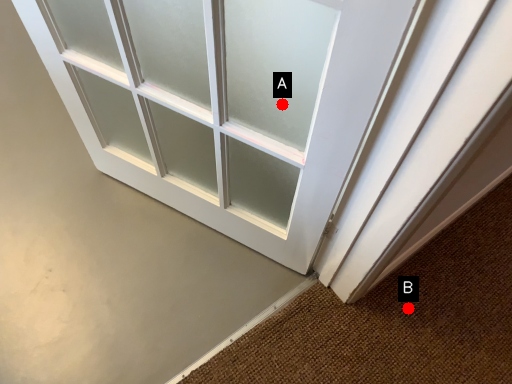
Question: Two points are circled on the image, labeled by A and B beside each circle. Which point is closer to the camera?

Choices:
 (A) A is closer
 (B) B is closer

Answer: (A)